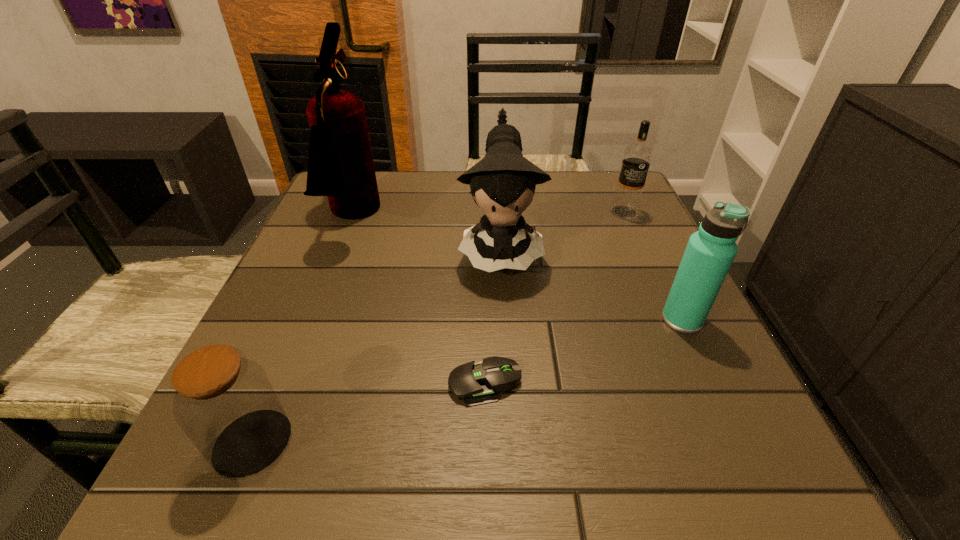
This screenshot has width=960, height=540. In order to click on free space that satisfies the following two spatial constraints: 1. on the label of the vodka; 2. at the nozzle of the tallest object in this screenshot , I will do 627,217.

Where is `free space that satisfies the following two spatial constraints: 1. on the label of the vodka; 2. at the nozzle of the tallest object`? The height and width of the screenshot is (540, 960). free space that satisfies the following two spatial constraints: 1. on the label of the vodka; 2. at the nozzle of the tallest object is located at coordinates (627, 217).

You are a GUI agent. You are given a task and a screenshot of the screen. Output one action in this format:
    pyautogui.click(x=<x>, y=<y>)
    Task: Click on the vacant space that satisfies the following two spatial constraints: 1. at the nozzle of the fourth farthest object; 2. on the right side of the tallest object
    This screenshot has height=540, width=960.
    Given the screenshot: What is the action you would take?
    pyautogui.click(x=312, y=319)

You are a GUI agent. You are given a task and a screenshot of the screen. Output one action in this format:
    pyautogui.click(x=<x>, y=<y>)
    Task: Click on the free spot that satisfies the following two spatial constraints: 1. at the nozzle of the tallest object; 2. on the left side of the computer mouse
    The height and width of the screenshot is (540, 960).
    Given the screenshot: What is the action you would take?
    pyautogui.click(x=287, y=384)